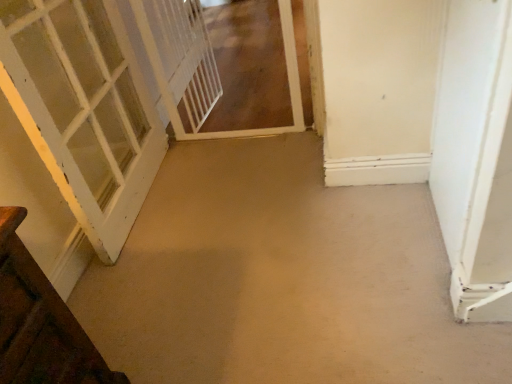
The image size is (512, 384). Find the location of `free space in front of white matte door at right, the 1th door when ordered from right to left`. free space in front of white matte door at right, the 1th door when ordered from right to left is located at coordinates (433, 318).